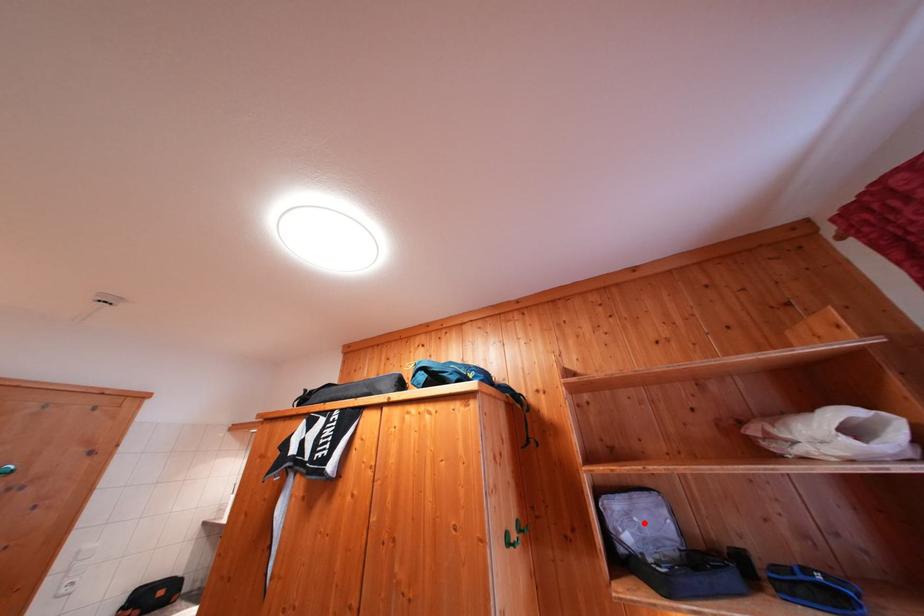
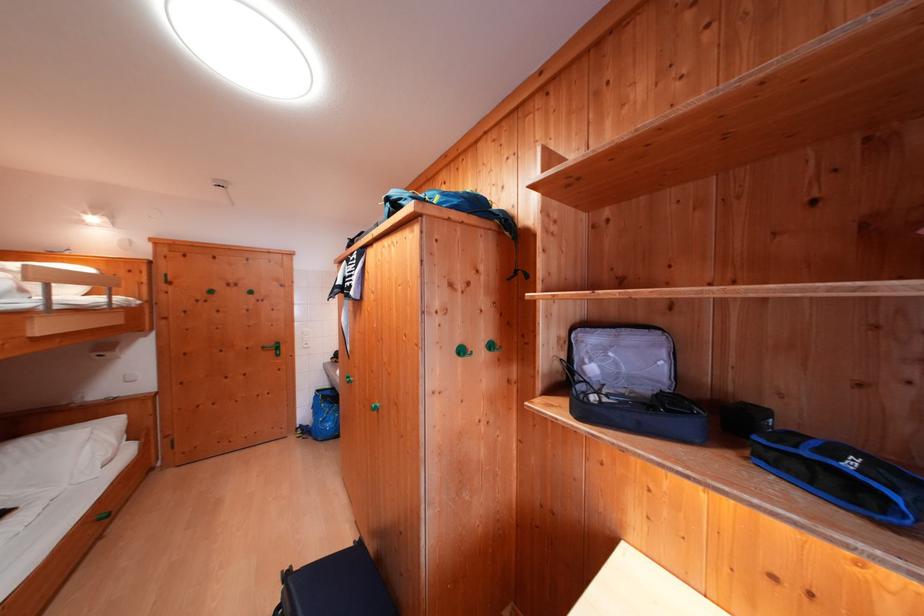
Locate, in the second image, the point that corresponds to the highlighted location in the first image.

(619, 359)